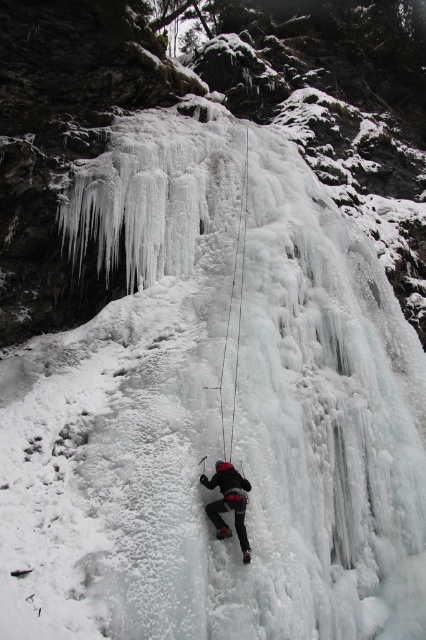
You are an ice climber preparing to secure your gear. You have the clear ice rope at center and the black matte climbing gear at center in your view. Which object is positioned higher up in the image?

The clear ice rope at center is positioned higher up in the image as it is much taller than the black matte climbing gear at center.

You are an ice climber preparing to secure your gear. You have a clear ice rope at center and a black matte climbing gear at center. Which object is located to the right of the other?

The clear ice rope at center is positioned on the right side of black matte climbing gear at center.